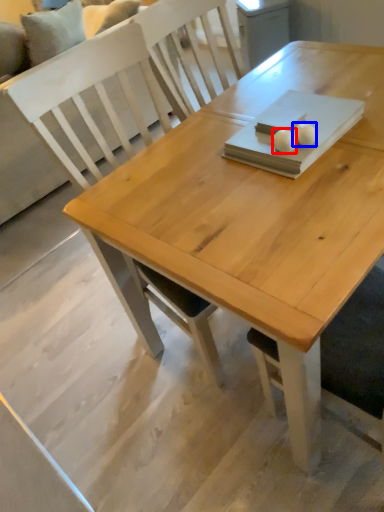
Question: Among these objects, which one is farthest to the camera, food (highlighted by a red box) or food (highlighted by a blue box)?

Choices:
 (A) food
 (B) food

Answer: (B)